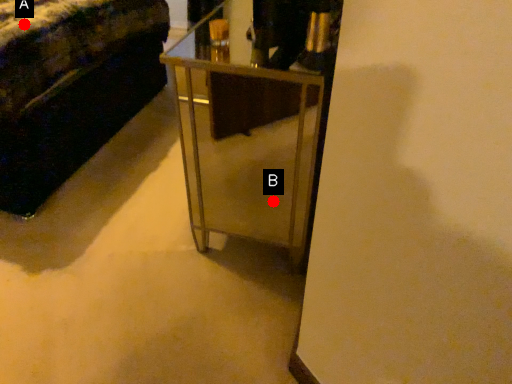
Question: Two points are circled on the image, labeled by A and B beside each circle. Which point is further to the camera?

Choices:
 (A) A is further
 (B) B is further

Answer: (A)